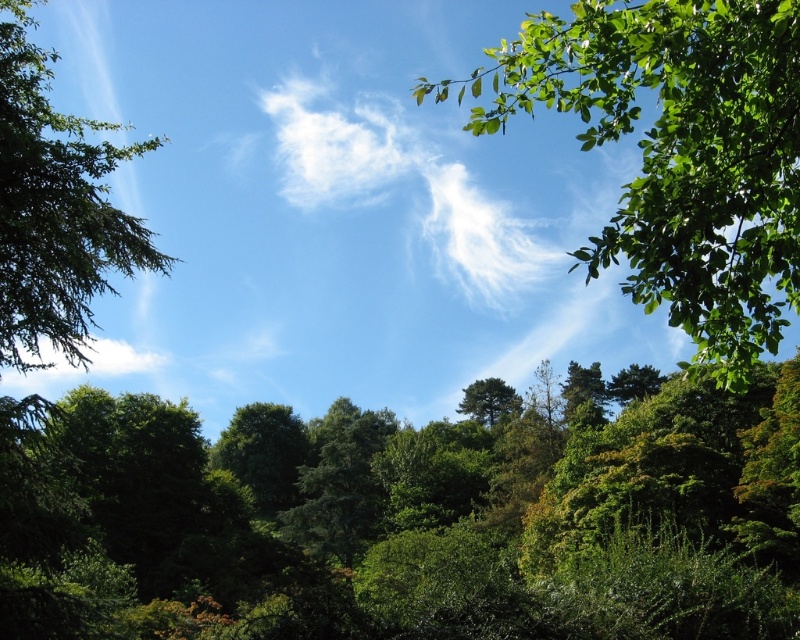
Question: Among these points, which one is nearest to the camera?

Choices:
 (A) (120, 358)
 (B) (72, 138)
 (C) (528, 257)
 (D) (494, 380)

Answer: (B)

Question: Can you confirm if green leafy forest at center is positioned to the right of green matte tree at center?

Choices:
 (A) yes
 (B) no

Answer: (B)

Question: Can you confirm if white cotton cloud at upper center is positioned below white fluffy cloud at left?

Choices:
 (A) yes
 (B) no

Answer: (B)

Question: Which point is farther to the camera?

Choices:
 (A) green matte tree at center
 (B) white fluffy cloud at left
 (C) green leafy branch at upper right
 (D) white cotton cloud at upper center

Answer: (D)

Question: Can you confirm if white cotton cloud at upper center is positioned to the left of green matte tree at center?

Choices:
 (A) no
 (B) yes

Answer: (B)

Question: Among these objects, which one is farthest from the camera?

Choices:
 (A) white cotton cloud at upper center
 (B) green leafy forest at center
 (C) white fluffy cloud at left

Answer: (A)